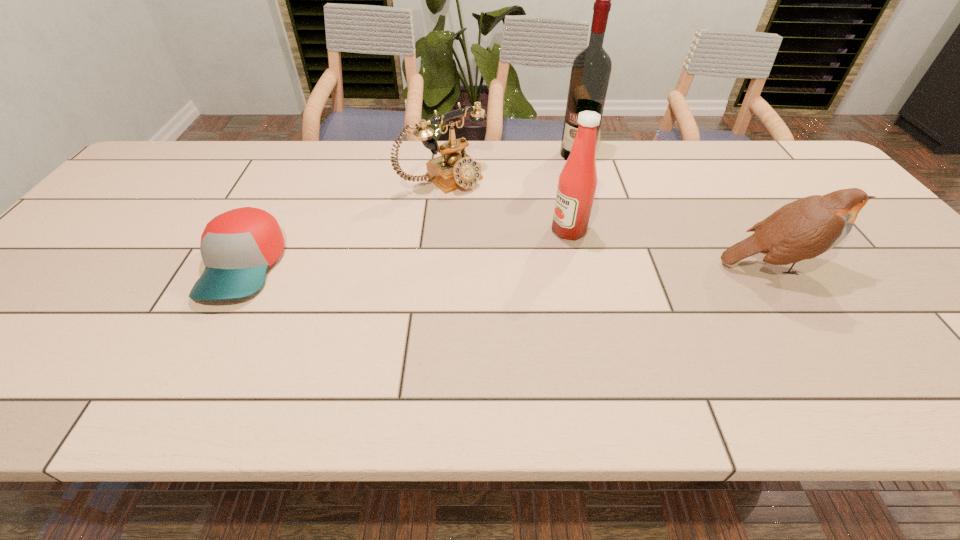
Identify the location of vacant space located on the front-facing side of the condiment. The image size is (960, 540). tap(467, 272).

Identify the location of free space located on the front and back of the alcohol. Image resolution: width=960 pixels, height=540 pixels. point(534,203).

Where is `free region located on the front and back of the alcohol`? Image resolution: width=960 pixels, height=540 pixels. free region located on the front and back of the alcohol is located at coordinates (516, 222).

Find the location of a particular element. The height and width of the screenshot is (540, 960). free space located 0.180m on the front and back of the alcohol is located at coordinates (544, 191).

The height and width of the screenshot is (540, 960). I want to click on vacant space located on the dial number of the telephone, so click(527, 243).

Find the location of a particular element. The width and height of the screenshot is (960, 540). vacant space located 0.370m on the dial number of the telephone is located at coordinates (557, 268).

The height and width of the screenshot is (540, 960). I want to click on free space located on the dial number of the telephone, so (508, 227).

The width and height of the screenshot is (960, 540). Identify the location of alcohol that is at the far edge. (591, 69).

This screenshot has width=960, height=540. Identify the location of telephone positioned at the far edge. (454, 169).

In the image, there is a desktop. Where is `vacant space at the far edge`? This screenshot has height=540, width=960. vacant space at the far edge is located at coordinates (734, 141).